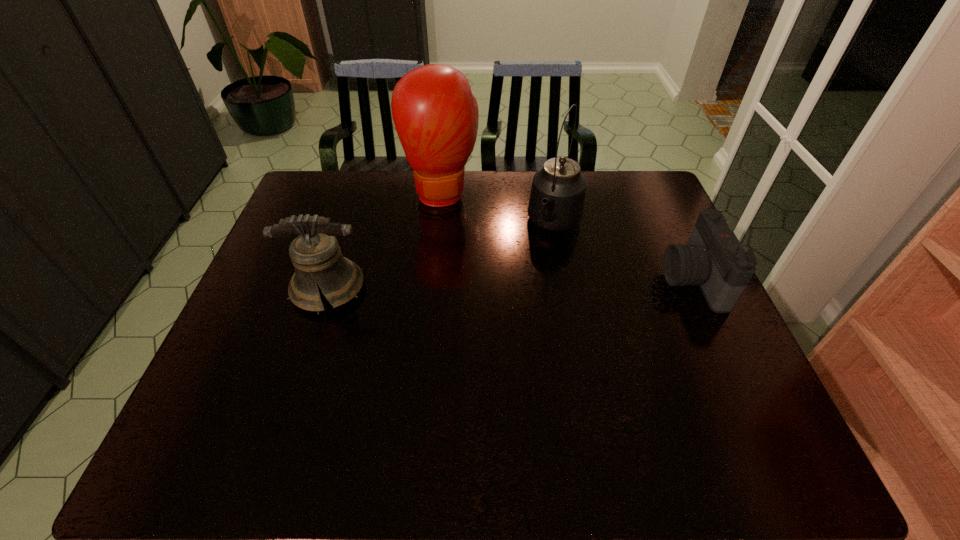
This screenshot has height=540, width=960. I want to click on vacant space on the desktop that is between the second shortest object and the rightmost object and is positioned spout on the kettle, so tap(524, 284).

Locate an element on the screen. free space on the desktop that is between the leftmost object and the shortest object and is positioned on the striking surface of the third object from right to left is located at coordinates (464, 285).